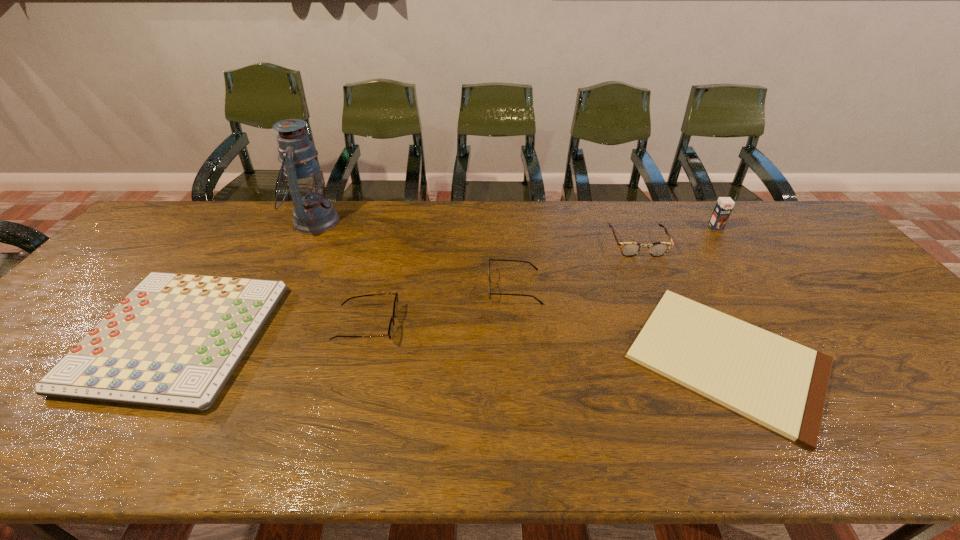
Identify the location of free space between the lantern and the farthest spectacles. (475, 233).

Image resolution: width=960 pixels, height=540 pixels. Find the location of `free point between the leftmost spectacles and the gameboard`. free point between the leftmost spectacles and the gameboard is located at coordinates (273, 331).

At what (x,y) coordinates should I click in order to perform the action: click on free spot between the second spectacles from left to right and the tallest object. Please return your answer as a coordinate pair (x, y). The height and width of the screenshot is (540, 960). Looking at the image, I should click on (415, 254).

Identify the location of vacant area between the rightmost spectacles and the third object from left to right. (502, 285).

Where is `empty location between the second spectacles from left to right and the lantern`? This screenshot has width=960, height=540. empty location between the second spectacles from left to right and the lantern is located at coordinates (415, 254).

Where is `vacant area that lies between the chocolate milk and the nearest spectacles`? vacant area that lies between the chocolate milk and the nearest spectacles is located at coordinates (541, 276).

The image size is (960, 540). What are the coordinates of `the sixth closest object to the second farthest spectacles` in the screenshot? It's located at (724, 205).

Point out which object is positioned as the second nearest to the leftmost spectacles. Please provide its 2D coordinates. Your answer should be formatted as a tuple, i.e. [(x, y)], where the tuple contains the x and y coordinates of a point satisfying the conditions above.

[(536, 268)]

You are a GUI agent. You are given a task and a screenshot of the screen. Output one action in this format:
    pyautogui.click(x=<x>, y=<y>)
    Task: Click on the spectacles that stands as the closest to the gameboard
    The image size is (960, 540).
    Given the screenshot: What is the action you would take?
    pyautogui.click(x=395, y=307)

This screenshot has height=540, width=960. I want to click on spectacles that is the closest one to the shortest object, so click(x=629, y=249).